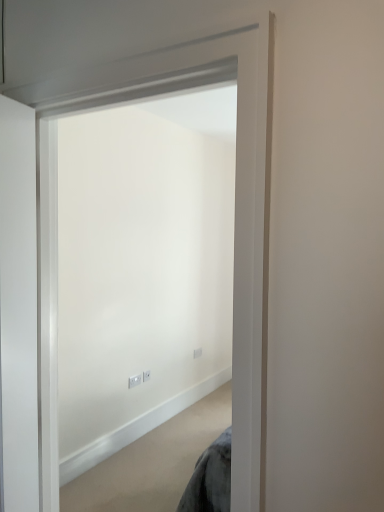
Question: From the image's perspective, is white plastic electric outlet at center, the third electric outlet from the left, on top of white plastic electric outlet at center, the second electric outlet positioned from the front?

Choices:
 (A) no
 (B) yes

Answer: (B)

Question: Is the depth of white plastic electric outlet at center, marked as the 1th electric outlet in a right-to-left arrangement, less than that of white plastic electric outlet at center, the 2th electric outlet from the left?

Choices:
 (A) yes
 (B) no

Answer: (B)

Question: Are white plastic electric outlet at center, the third electric outlet from the left, and white plastic electric outlet at center, placed as the second electric outlet when sorted from right to left, located far from each other?

Choices:
 (A) yes
 (B) no

Answer: (B)

Question: Is white plastic electric outlet at center, the 3th electric outlet in the front-to-back sequence, to the right of white plastic electric outlet at center, the second electric outlet when ordered from back to front, from the viewer's perspective?

Choices:
 (A) yes
 (B) no

Answer: (A)

Question: From a real-world perspective, is white plastic electric outlet at center, the 3th electric outlet in the front-to-back sequence, positioned over white plastic electric outlet at center, the second electric outlet when ordered from back to front, based on gravity?

Choices:
 (A) yes
 (B) no

Answer: (B)

Question: From the image's perspective, is white plastic electric outlet at center, the first electric outlet when ordered from front to back, above or below white plastic electric outlet at center, the first electric outlet from the back?

Choices:
 (A) above
 (B) below

Answer: (B)

Question: Relative to white plastic electric outlet at center, the first electric outlet from the back, is white plastic electric outlet at center, which is counted as the 1th electric outlet, starting from the left, in front or behind?

Choices:
 (A) front
 (B) behind

Answer: (A)

Question: Would you say white plastic electric outlet at center, the third electric outlet from the back, is to the left or to the right of white plastic electric outlet at center, the 3th electric outlet in the front-to-back sequence, in the picture?

Choices:
 (A) right
 (B) left

Answer: (B)

Question: Considering the positions of white plastic electric outlet at center, the first electric outlet when ordered from front to back, and white plastic electric outlet at center, the first electric outlet from the back, in the image, is white plastic electric outlet at center, the first electric outlet when ordered from front to back, bigger or smaller than white plastic electric outlet at center, the first electric outlet from the back,?

Choices:
 (A) small
 (B) big

Answer: (A)

Question: Based on their sizes in the image, would you say white plastic electric outlet at center, the third electric outlet viewed from the right, is bigger or smaller than white plastic electric outlet at center, placed as the second electric outlet when sorted from right to left?

Choices:
 (A) big
 (B) small

Answer: (A)

Question: From a real-world perspective, is white plastic electric outlet at center, the first electric outlet when ordered from front to back, above or below white plastic electric outlet at center, placed as the second electric outlet when sorted from right to left?

Choices:
 (A) below
 (B) above

Answer: (A)

Question: Do you think white plastic electric outlet at center, which is counted as the 1th electric outlet, starting from the left, is within white plastic electric outlet at center, the second electric outlet positioned from the front, or outside of it?

Choices:
 (A) inside
 (B) outside

Answer: (B)

Question: Is white plastic electric outlet at center, which is counted as the 1th electric outlet, starting from the left, in front of or behind white plastic electric outlet at center, the 2th electric outlet from the left, in the image?

Choices:
 (A) front
 (B) behind

Answer: (A)

Question: From a real-world perspective, is white matte door at center positioned above or below white plastic electric outlet at center, which is counted as the 1th electric outlet, starting from the left?

Choices:
 (A) below
 (B) above

Answer: (B)

Question: From the image's perspective, is white matte door at center above or below white plastic electric outlet at center, the third electric outlet viewed from the right?

Choices:
 (A) above
 (B) below

Answer: (A)